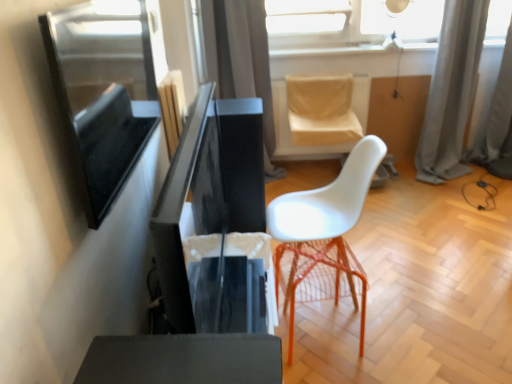
Where is `free spot in front of white plastic chair at center`? The width and height of the screenshot is (512, 384). free spot in front of white plastic chair at center is located at coordinates (378, 352).